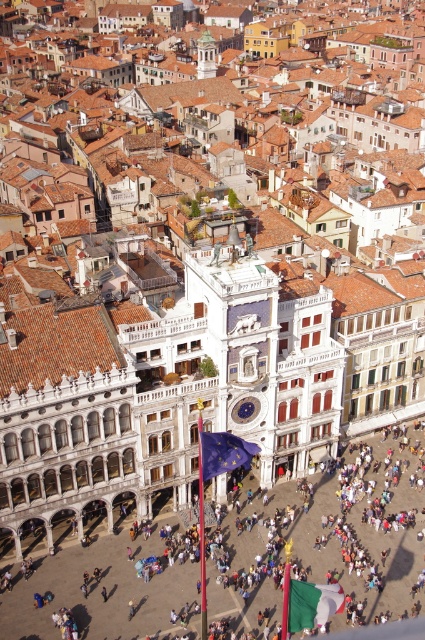
You are a tourist in Venice and see the white stone flagpole at center and the white marble clock tower at center. Which one appears taller in the image?

The white marble clock tower at center is taller than the white stone flagpole at center, so the clock tower appears taller.

You are standing in the urban square and want to take a photo of the white stone flagpole at center. The camera you are using has a maximum focus range of 70 meters. Will you be able to capture the flagpole clearly?

The white stone flagpole at center is 73.17 meters from viewer, which exceeds the camera maximum focus range of 70 meters. Therefore, you won not be able to capture the flagpole clearly.